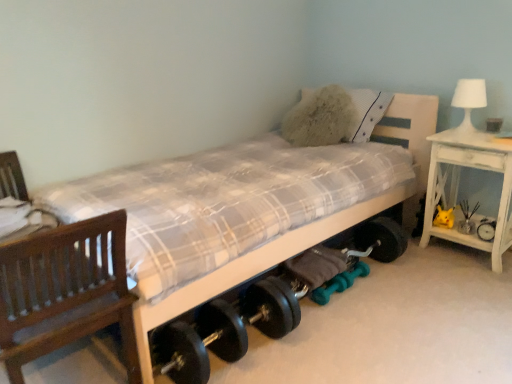
Question: Choose the correct answer: Is teal rubber dumbbell at lower center, placed as the 2th dumbbell when sorted from right to left, inside yellow plush toy at right or outside it?

Choices:
 (A) outside
 (B) inside

Answer: (A)

Question: From the image's perspective, relative to yellow plush toy at right, is teal rubber dumbbell at lower center, marked as the first dumbbell in a left-to-right arrangement, above or below?

Choices:
 (A) above
 (B) below

Answer: (B)

Question: Based on their relative distances, which object is nearer to the yellow plush toy at right?

Choices:
 (A) teal rubber dumbbell at lower center, which appears as the 2th dumbbell when viewed from the left
 (B) brown wooden chair at left
 (C) white glossy table lamp at upper right
 (D) white distressed wood nightstand at right
 (E) teal rubber dumbbell at lower center, placed as the 2th dumbbell when sorted from right to left

Answer: (D)

Question: Which is farther from the white wood bed at center?

Choices:
 (A) teal rubber dumbbell at lower center, marked as the first dumbbell in a left-to-right arrangement
 (B) teal rubber dumbbell at lower center, which appears as the 2th dumbbell when viewed from the left
 (C) white distressed wood nightstand at right
 (D) fuzzy white pillow at upper center
 (E) brown wooden chair at left

Answer: (B)